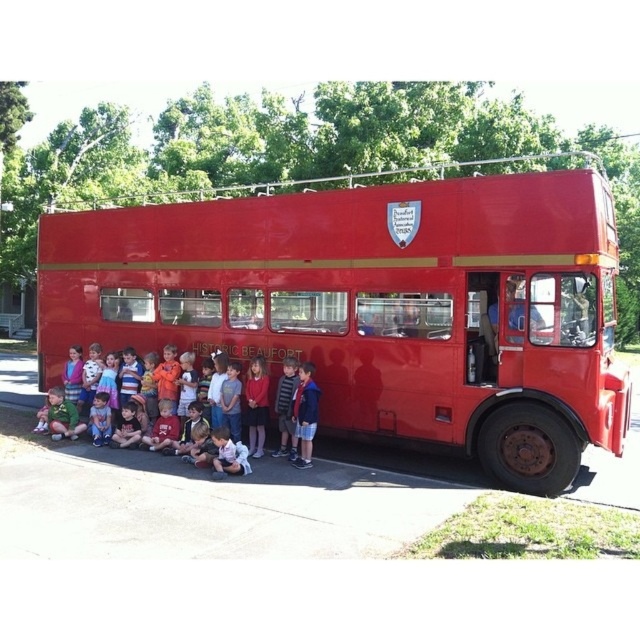
Question: Does shiny red bus at center lie in front of matte red shirt at lower center?

Choices:
 (A) no
 (B) yes

Answer: (B)

Question: Among these points, which one is farthest from the camera?

Choices:
 (A) (189, 212)
 (B) (294, 410)

Answer: (A)

Question: Does shiny red bus at center have a lesser width compared to matte red shirt at lower center?

Choices:
 (A) no
 (B) yes

Answer: (A)

Question: Which object is closer to the camera taking this photo?

Choices:
 (A) matte red shirt at lower center
 (B) shiny red bus at center

Answer: (B)

Question: Is shiny red bus at center positioned before matte red shirt at lower center?

Choices:
 (A) no
 (B) yes

Answer: (B)